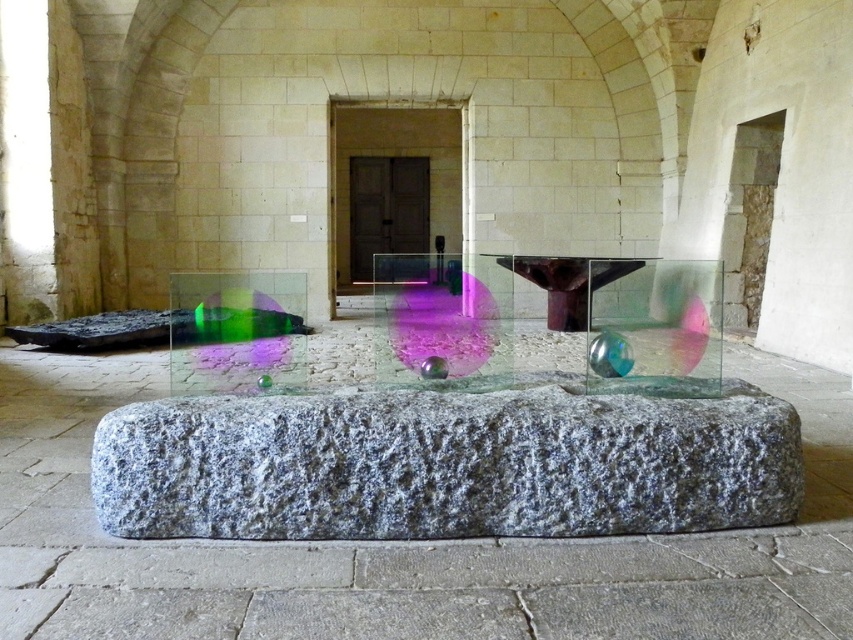
Question: Which object appears closest to the camera in this image?

Choices:
 (A) granite stone at center
 (B) transparent glass table at center

Answer: (A)

Question: Does granite stone at center appear under transparent glass table at center?

Choices:
 (A) yes
 (B) no

Answer: (A)

Question: Is granite stone at center bigger than transparent glass table at center?

Choices:
 (A) no
 (B) yes

Answer: (A)

Question: Does granite stone at center appear over transparent glass table at center?

Choices:
 (A) no
 (B) yes

Answer: (A)

Question: Which point is farther to the camera?

Choices:
 (A) (677, 413)
 (B) (375, 380)

Answer: (B)